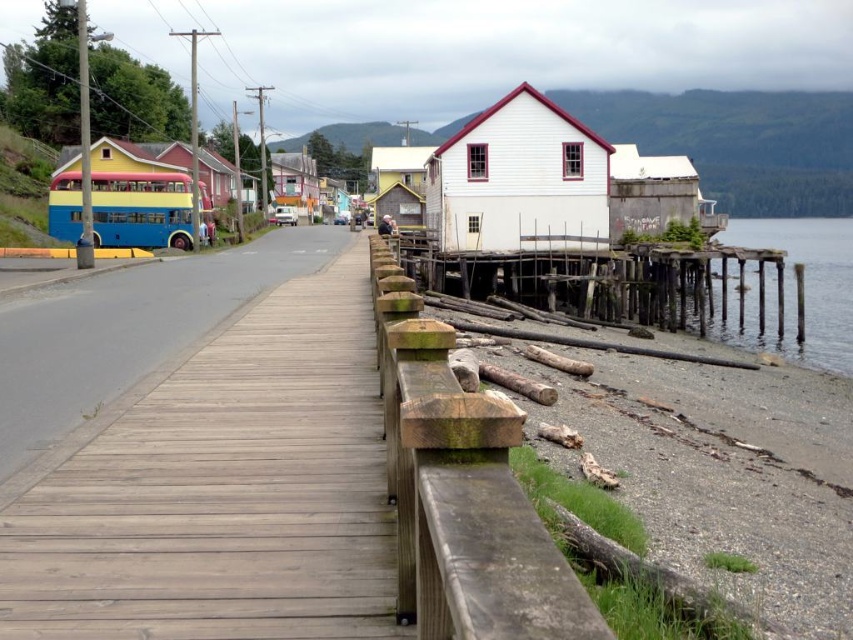
Does wooden planks at center appear on the left side of transparent wooden pier at lower right?

Correct, you'll find wooden planks at center to the left of transparent wooden pier at lower right.

In the scene shown: Can you confirm if wooden planks at center is positioned above transparent wooden pier at lower right?

No, wooden planks at center is not above transparent wooden pier at lower right.

Between point (100, 554) and point (801, 344), which one is positioned in front?

Point (100, 554)

What are the coordinates of `wooden planks at center` in the screenshot? It's located at (221, 490).

Between white wood house at center and pink wood house at center, which one has more height?

Standing taller between the two is pink wood house at center.

Image resolution: width=853 pixels, height=640 pixels. I want to click on white wood house at center, so click(x=519, y=180).

Image resolution: width=853 pixels, height=640 pixels. I want to click on white wood house at center, so click(519, 180).

Does wooden planks at center have a lesser width compared to pink wood house at center?

Correct, wooden planks at center's width is less than pink wood house at center's.

Is wooden planks at center positioned behind pink wood house at center?

No.

What do you see at coordinates (221, 490) in the screenshot? The height and width of the screenshot is (640, 853). I see `wooden planks at center` at bounding box center [221, 490].

Find the location of a particular element. The width and height of the screenshot is (853, 640). wooden planks at center is located at coordinates (221, 490).